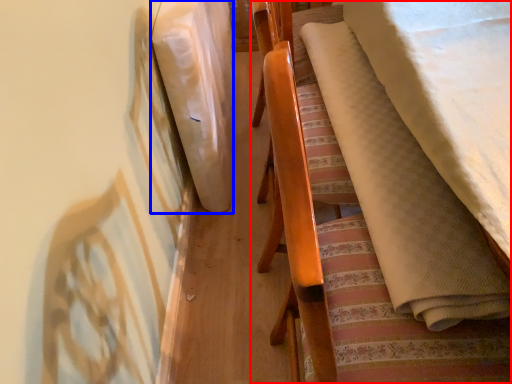
Question: Which of the following is the closest to the observer, furniture (highlighted by a red box) or blanket (highlighted by a blue box)?

Choices:
 (A) furniture
 (B) blanket

Answer: (A)